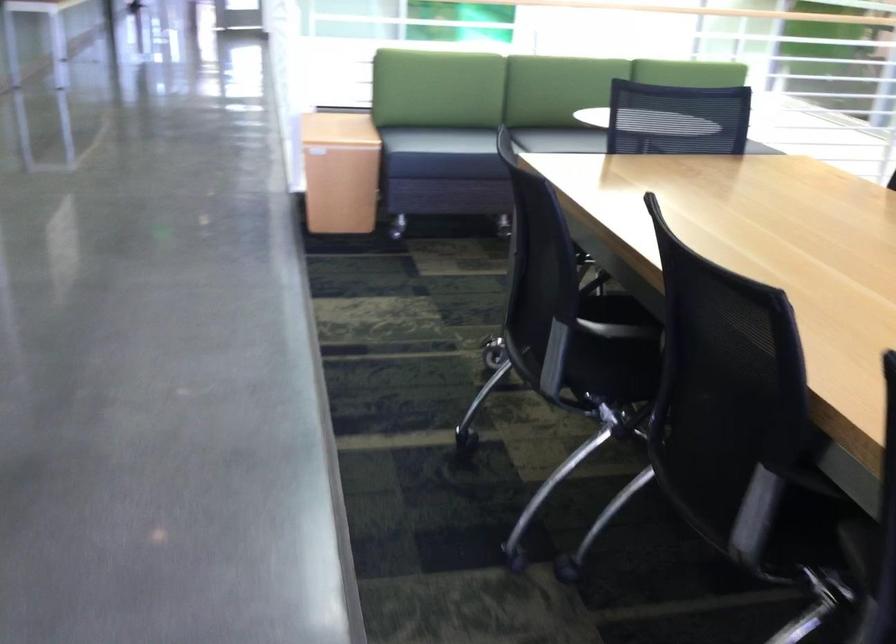
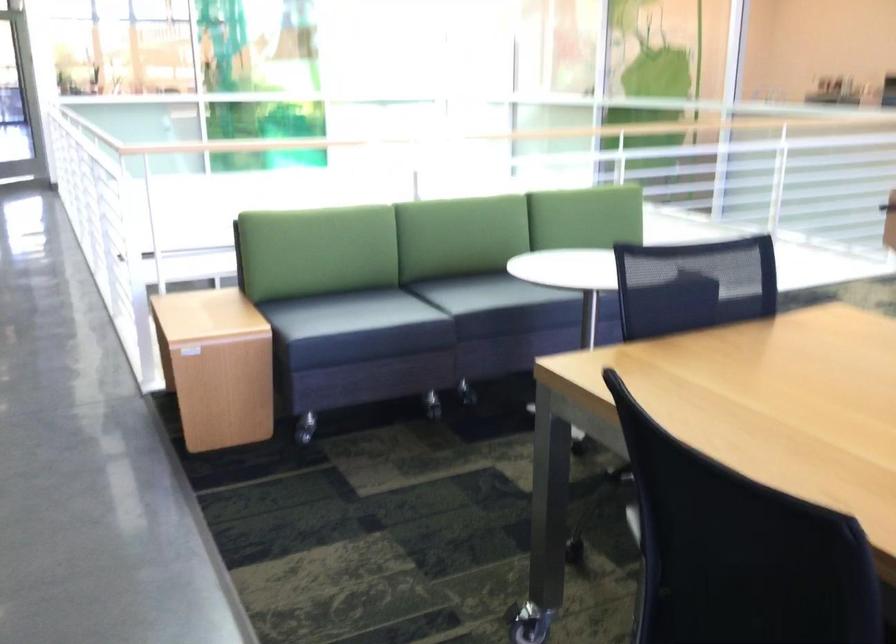
The point at (569, 138) is marked in the first image. Where is the corresponding point in the second image?

(488, 292)